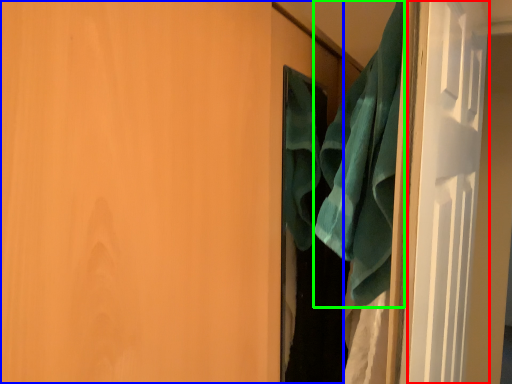
Question: Which object is the closest to the screen door (highlighted by a red box)? Choose among these: door (highlighted by a blue box) or beach towel (highlighted by a green box).

Choices:
 (A) door
 (B) beach towel

Answer: (B)